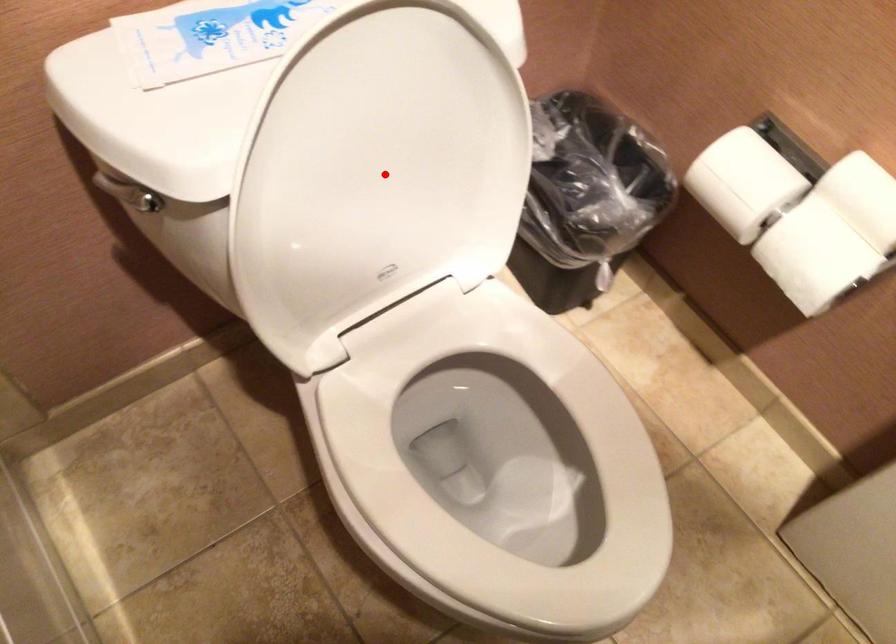
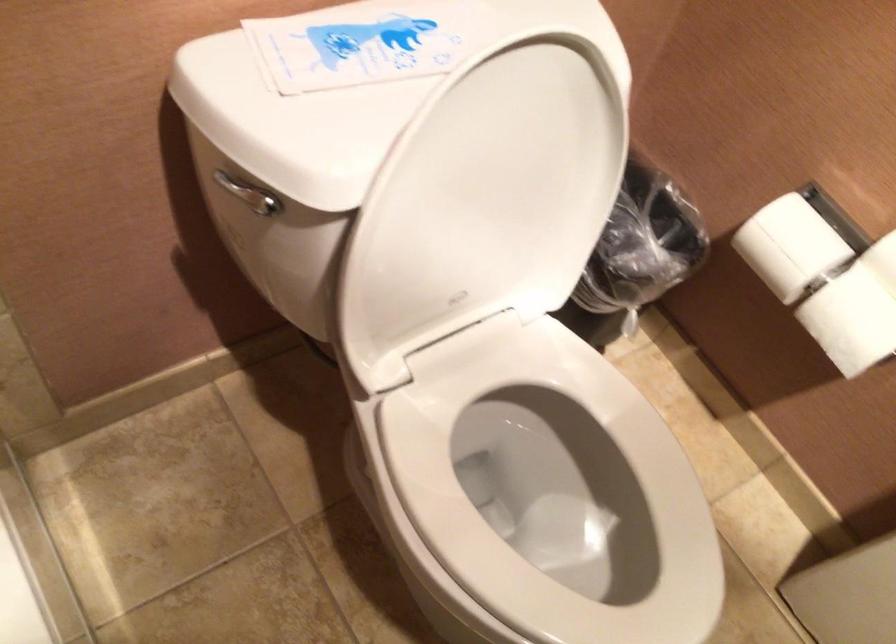
Question: I am providing you with two images of the same scene from different viewpoints. A red point is marked on the first image. Can you still see the location of the red point in image 2?

Choices:
 (A) Yes
 (B) No

Answer: (A)